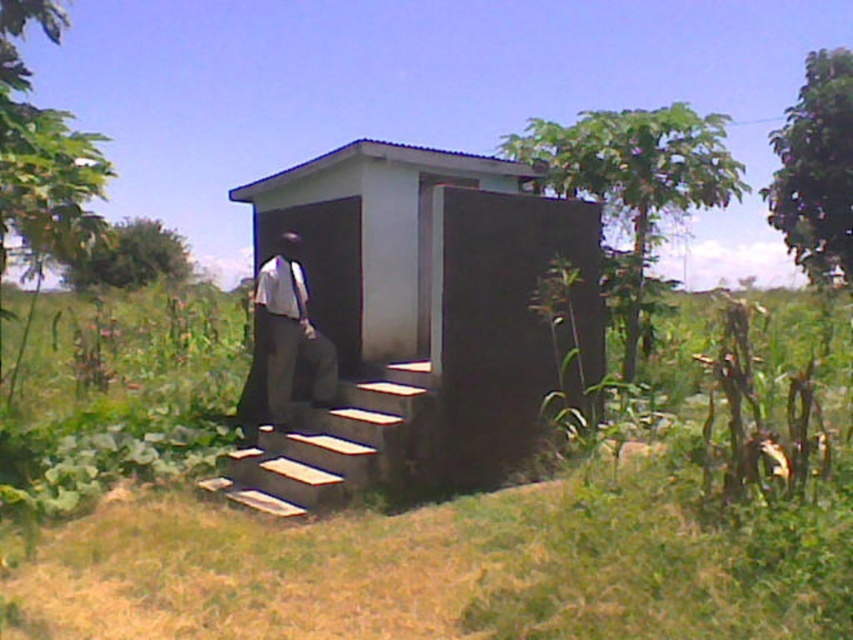
Question: Which of the following is the closest to the observer?

Choices:
 (A) (302, 296)
 (B) (287, 346)

Answer: (B)

Question: Does white concrete stairs at center have a larger size compared to white shirt at center?

Choices:
 (A) yes
 (B) no

Answer: (A)

Question: Which point is farther from the camera taking this photo?

Choices:
 (A) (277, 378)
 (B) (294, 480)

Answer: (A)

Question: Can you confirm if concrete block hut at center is thinner than white shirt at center?

Choices:
 (A) no
 (B) yes

Answer: (A)

Question: Which point is farther from the camera taking this photo?

Choices:
 (A) (297, 307)
 (B) (360, 234)

Answer: (B)

Question: Can you confirm if white concrete stairs at center is wider than white fabric tie at center?

Choices:
 (A) no
 (B) yes

Answer: (B)